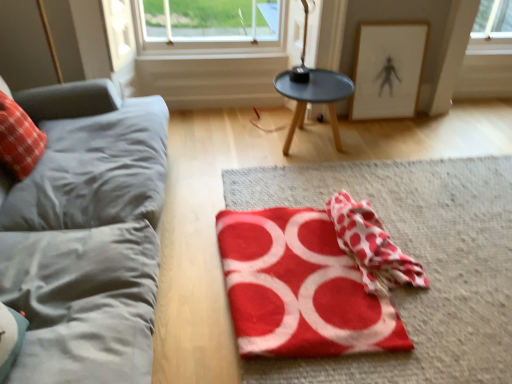
Identify the location of free spot above black matte table at center (from a real-world perspective). (315, 87).